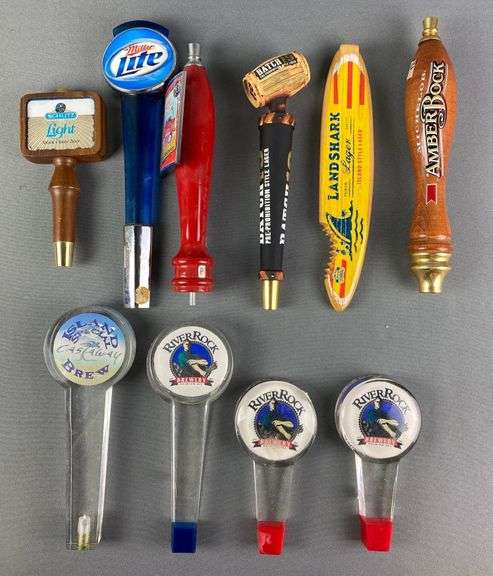
Locate an element on the screen. top of beer tap handles is located at coordinates 391,412, 287,418, 184,359, 89,357, 56,130, 140,67, 190,94, 276,87, 340,90, 429,79.